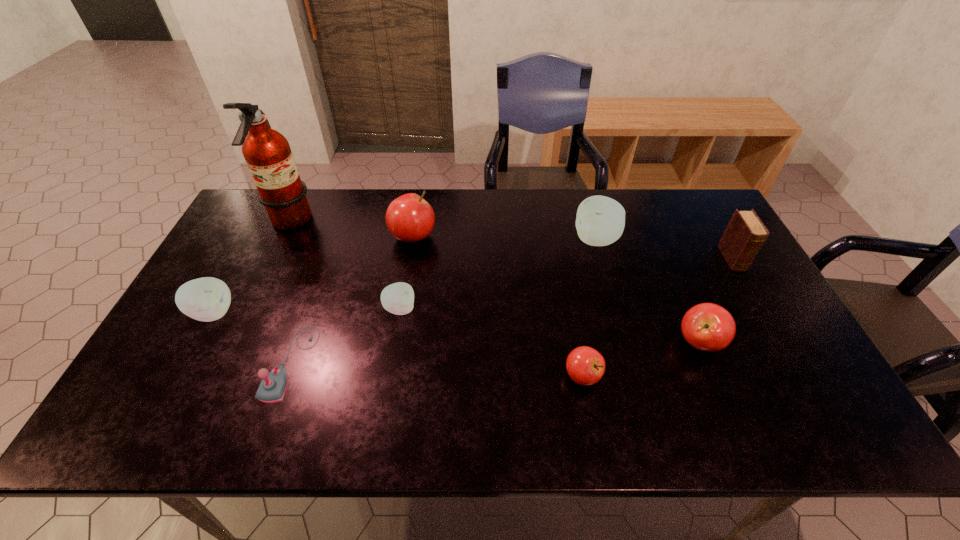
The image size is (960, 540). I want to click on vacant space that satisfies the following two spatial constraints: 1. on the back side of the sixth object from left to right; 2. on the nozzle and handle of the fire extinguisher, so click(554, 222).